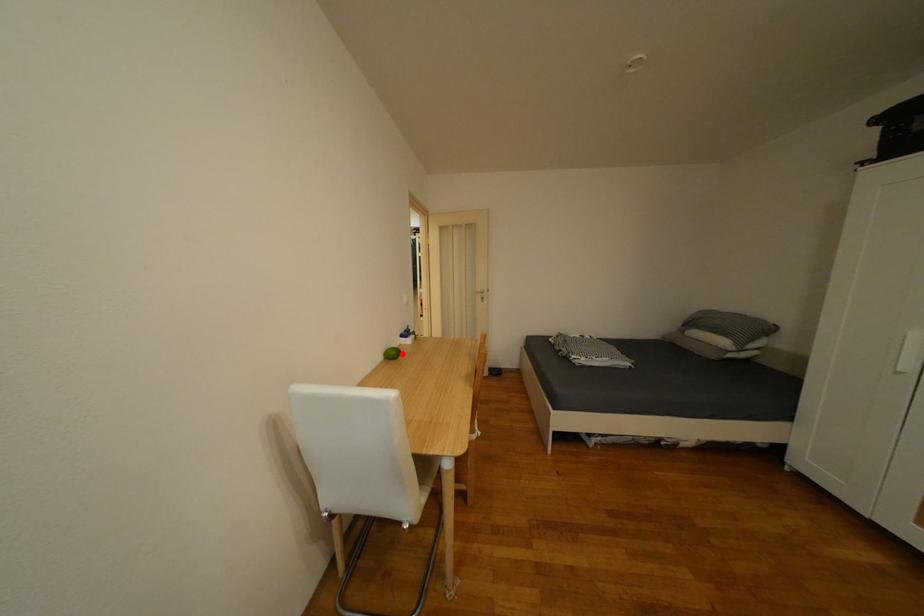
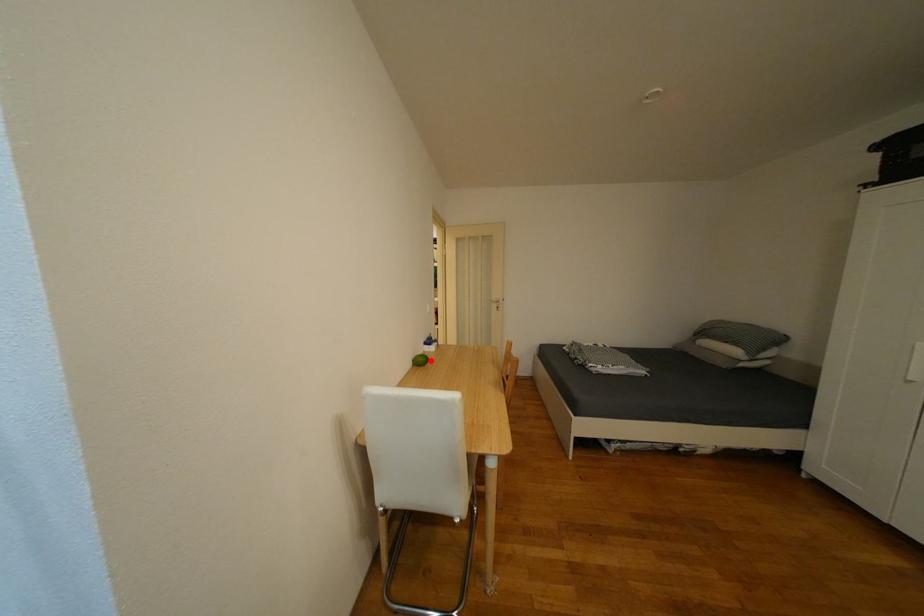
In the scene shown: I am providing you with two images of the same scene from different viewpoints. A red point is marked on the first image and another point is marked on the second image. Are the points marked in image1 and image2 representing the same 3D position?

Yes